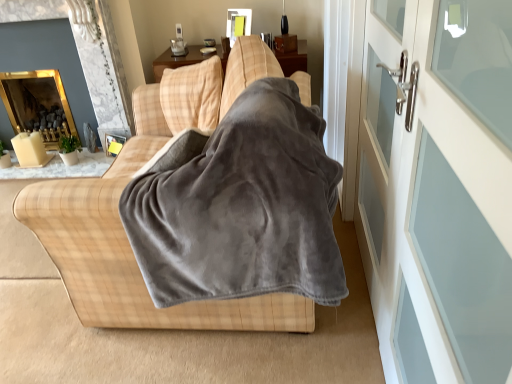
Looking at this image, how much space does white glass door at right, acting as the 1th screen door starting from the front, occupy horizontally?

It is 8.00 centimeters.

Describe the element at coordinates (38, 104) in the screenshot. I see `gold reflective mirror at upper left, positioned as the 1th fireplace in back-to-front order` at that location.

Measure the distance between point (109, 19) and camera.

The distance of point (109, 19) from camera is 2.83 meters.

The height and width of the screenshot is (384, 512). I want to click on metallic gold picture frame at upper left, so click(113, 139).

The height and width of the screenshot is (384, 512). Describe the element at coordinates (131, 257) in the screenshot. I see `plaid fabric couch at center` at that location.

This screenshot has width=512, height=384. Find the location of `white glass door at right, acting as the 1th screen door starting from the front`. white glass door at right, acting as the 1th screen door starting from the front is located at coordinates (438, 188).

Is gold reflective fireplace at upper left, the 2th fireplace from the back, looking in the opposite direction of white glass screen door at right, positioned as the 1th screen door in back-to-front order?

That's not correct — gold reflective fireplace at upper left, the 2th fireplace from the back, is not looking away from white glass screen door at right, positioned as the 1th screen door in back-to-front order.

Can you confirm if gold reflective fireplace at upper left, positioned as the first fireplace in front-to-back order, is thinner than white glass screen door at right, the second screen door when ordered from front to back?

In fact, gold reflective fireplace at upper left, positioned as the first fireplace in front-to-back order, might be wider than white glass screen door at right, the second screen door when ordered from front to back.

Does point (42, 22) appear closer or farther from the camera than point (403, 143)?

Clearly, point (42, 22) is more distant from the camera than point (403, 143).

Can you tell me how much gold reflective fireplace at upper left, the 2th fireplace from the back, and white glass screen door at right, positioned as the 1th screen door in back-to-front order, differ in facing direction?

gold reflective fireplace at upper left, the 2th fireplace from the back, and white glass screen door at right, positioned as the 1th screen door in back-to-front order, are facing 90.5 degrees away from each other.

Does point (384, 361) appear closer or farther from the camera than point (252, 143)?

Point (384, 361).

Consider the image. Which is more to the right, white glass screen door at right, the second screen door when ordered from front to back, or gray fleece blanket at center?

From the viewer's perspective, white glass screen door at right, the second screen door when ordered from front to back, appears more on the right side.

Is white glass screen door at right, the second screen door when ordered from front to back, outside of gray fleece blanket at center?

Yes.

In the scene shown: Is white glass screen door at right, the second screen door when ordered from front to back, next to gray fleece blanket at center and touching it?

No, white glass screen door at right, the second screen door when ordered from front to back, is not making contact with gray fleece blanket at center.

At what (x,y) coordinates should I click in order to perform the action: click on picture frame behind the white glass screen door at right, the second screen door when ordered from front to back. Please return your answer as a coordinate pair (x, y). The width and height of the screenshot is (512, 384). Looking at the image, I should click on (113, 139).

Considering the relative sizes of metallic gold picture frame at upper left and white glass screen door at right, positioned as the 1th screen door in back-to-front order, in the image provided, is metallic gold picture frame at upper left thinner than white glass screen door at right, positioned as the 1th screen door in back-to-front order,?

Incorrect, the width of metallic gold picture frame at upper left is not less than that of white glass screen door at right, positioned as the 1th screen door in back-to-front order.

Is metallic gold picture frame at upper left smaller than white glass screen door at right, the second screen door when ordered from front to back?

Yes, metallic gold picture frame at upper left is smaller than white glass screen door at right, the second screen door when ordered from front to back.

Considering the positions of objects metallic gold picture frame at upper left and white glass screen door at right, positioned as the 1th screen door in back-to-front order, in the image provided, who is behind, metallic gold picture frame at upper left or white glass screen door at right, positioned as the 1th screen door in back-to-front order,?

metallic gold picture frame at upper left is further away from the camera.

From the picture: Is gold reflective fireplace at upper left, the 2th fireplace from the back, in contact with gray fleece blanket at center?

No, gold reflective fireplace at upper left, the 2th fireplace from the back, is not touching gray fleece blanket at center.

From the image's perspective, which one is positioned lower, gold reflective fireplace at upper left, the 2th fireplace from the back, or gray fleece blanket at center?

gray fleece blanket at center is shown below in the image.

Considering the points (114, 60) and (284, 251), which point is behind, point (114, 60) or point (284, 251)?

The point (114, 60) is farther.

Is gold reflective fireplace at upper left, positioned as the first fireplace in front-to-back order, to the left or to the right of gray fleece blanket at center in the image?

From the image, it's evident that gold reflective fireplace at upper left, positioned as the first fireplace in front-to-back order, is to the left of gray fleece blanket at center.

How different are the orientations of white glass door at right, acting as the 1th screen door starting from the front, and gray fleece blanket at center in degrees?

white glass door at right, acting as the 1th screen door starting from the front, and gray fleece blanket at center are facing 2.84 degrees away from each other.

Does white glass door at right, acting as the 1th screen door starting from the front, appear on the left side of gray fleece blanket at center?

Incorrect, white glass door at right, acting as the 1th screen door starting from the front, is not on the left side of gray fleece blanket at center.

Which object is closer to the camera, white glass door at right, the 2th screen door in the back-to-front sequence, or gray fleece blanket at center?

Positioned in front is white glass door at right, the 2th screen door in the back-to-front sequence.

Is white glass door at right, the 2th screen door in the back-to-front sequence, situated inside gray fleece blanket at center or outside?

white glass door at right, the 2th screen door in the back-to-front sequence, lies outside gray fleece blanket at center.

From the image's perspective, does metallic gold picture frame at upper left appear higher than plaid fabric couch at center?

Yes, from the image's perspective, metallic gold picture frame at upper left is above plaid fabric couch at center.

Is plaid fabric couch at center located within metallic gold picture frame at upper left?

No.

Which point is more distant from viewer, (106,129) or (87,280)?

Positioned behind is point (106,129).

From the picture: Is metallic gold picture frame at upper left aimed at plaid fabric couch at center?

No, metallic gold picture frame at upper left does not turn towards plaid fabric couch at center.

How different are the orientations of metallic gold picture frame at upper left and gold reflective fireplace at upper left, the 2th fireplace from the back, in degrees?

The facing directions of metallic gold picture frame at upper left and gold reflective fireplace at upper left, the 2th fireplace from the back, are 26.2 degrees apart.

Which of these two, metallic gold picture frame at upper left or gold reflective fireplace at upper left, positioned as the first fireplace in front-to-back order, stands taller?

gold reflective fireplace at upper left, positioned as the first fireplace in front-to-back order.

Is metallic gold picture frame at upper left smaller than gold reflective fireplace at upper left, positioned as the first fireplace in front-to-back order?

Correct, metallic gold picture frame at upper left occupies less space than gold reflective fireplace at upper left, positioned as the first fireplace in front-to-back order.

From the image's perspective, between metallic gold picture frame at upper left and gold reflective fireplace at upper left, positioned as the first fireplace in front-to-back order, who is located below?

From the image's view, metallic gold picture frame at upper left is below.

This screenshot has height=384, width=512. In order to click on screen door directly beneath the gold reflective fireplace at upper left, positioned as the first fireplace in front-to-back order (from a real-world perspective) in this screenshot , I will do `click(383, 163)`.

Where is `blanket behind the white glass screen door at right, the second screen door when ordered from front to back`? Image resolution: width=512 pixels, height=384 pixels. blanket behind the white glass screen door at right, the second screen door when ordered from front to back is located at coordinates (243, 208).

Looking at the image, which one is located closer to gray fleece blanket at center, metallic gold picture frame at upper left or white glass door at right, the 2th screen door in the back-to-front sequence?

The object closer to gray fleece blanket at center is white glass door at right, the 2th screen door in the back-to-front sequence.

Based on the photo, based on their spatial positions, is gold reflective fireplace at upper left, the 2th fireplace from the back, or white glass door at right, acting as the 1th screen door starting from the front, closer to gray fleece blanket at center?

white glass door at right, acting as the 1th screen door starting from the front, lies closer to gray fleece blanket at center than the other object.

Based on the photo, which object lies further to the anchor point white glass screen door at right, the second screen door when ordered from front to back, gold reflective fireplace at upper left, the 2th fireplace from the back, or gold reflective mirror at upper left, positioned as the 1th fireplace in back-to-front order?

Based on the image, gold reflective mirror at upper left, positioned as the 1th fireplace in back-to-front order, appears to be further to white glass screen door at right, the second screen door when ordered from front to back.

When comparing their distances from white glass door at right, the 2th screen door in the back-to-front sequence, does metallic gold picture frame at upper left or gold reflective mirror at upper left, positioned as the 1th fireplace in back-to-front order, seem further?

gold reflective mirror at upper left, positioned as the 1th fireplace in back-to-front order.

When comparing their distances from metallic gold picture frame at upper left, does plaid fabric couch at center or white glass door at right, acting as the 1th screen door starting from the front, seem further?

white glass door at right, acting as the 1th screen door starting from the front, is further to metallic gold picture frame at upper left.

In the scene shown: Considering their positions, is white glass door at right, acting as the 1th screen door starting from the front, positioned closer to gold reflective fireplace at upper left, the 2th fireplace from the back, than gold reflective mirror at upper left, placed as the second fireplace when sorted from front to back?

gold reflective mirror at upper left, placed as the second fireplace when sorted from front to back, lies closer to gold reflective fireplace at upper left, the 2th fireplace from the back, than the other object.

Based on their spatial positions, is gold reflective fireplace at upper left, the 2th fireplace from the back, or plaid fabric couch at center closer to white glass screen door at right, the second screen door when ordered from front to back?

The object closer to white glass screen door at right, the second screen door when ordered from front to back, is plaid fabric couch at center.

Based on the photo, which object lies nearer to the anchor point metallic gold picture frame at upper left, gray fleece blanket at center or gold reflective mirror at upper left, positioned as the 1th fireplace in back-to-front order?

gold reflective mirror at upper left, positioned as the 1th fireplace in back-to-front order, is closer to metallic gold picture frame at upper left.

Locate an element on the screen. This screenshot has height=384, width=512. fireplace positioned between gray fleece blanket at center and metallic gold picture frame at upper left from near to far is located at coordinates (103, 73).

The width and height of the screenshot is (512, 384). What are the coordinates of `blanket positioned between white glass door at right, acting as the 1th screen door starting from the front, and gold reflective fireplace at upper left, the 2th fireplace from the back, from near to far` in the screenshot? It's located at (243, 208).

Identify the location of studio couch located between gray fleece blanket at center and gold reflective fireplace at upper left, positioned as the first fireplace in front-to-back order, in the depth direction. (131, 257).

Locate an element on the screen. fireplace between white glass door at right, acting as the 1th screen door starting from the front, and gold reflective mirror at upper left, placed as the second fireplace when sorted from front to back, in the front-back direction is located at coordinates (103, 73).